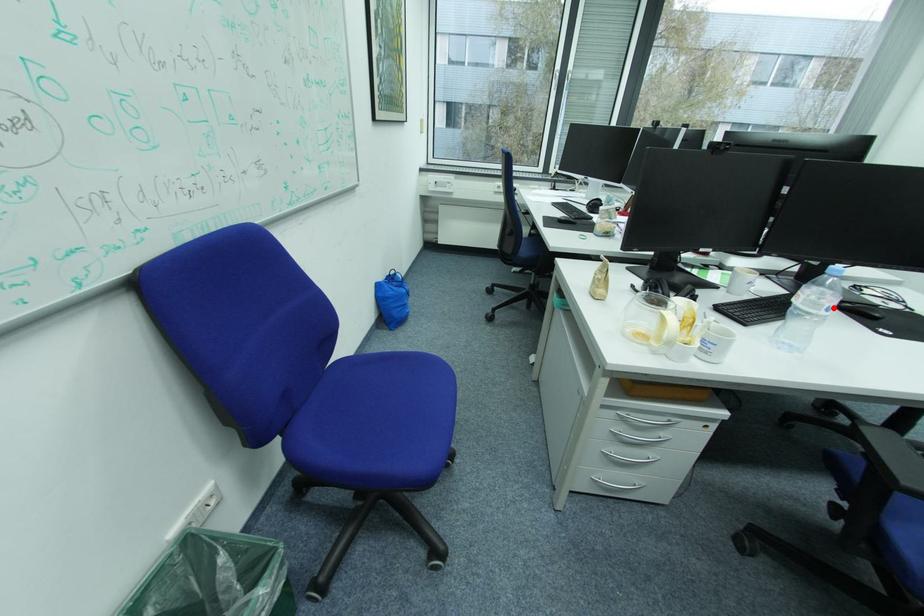
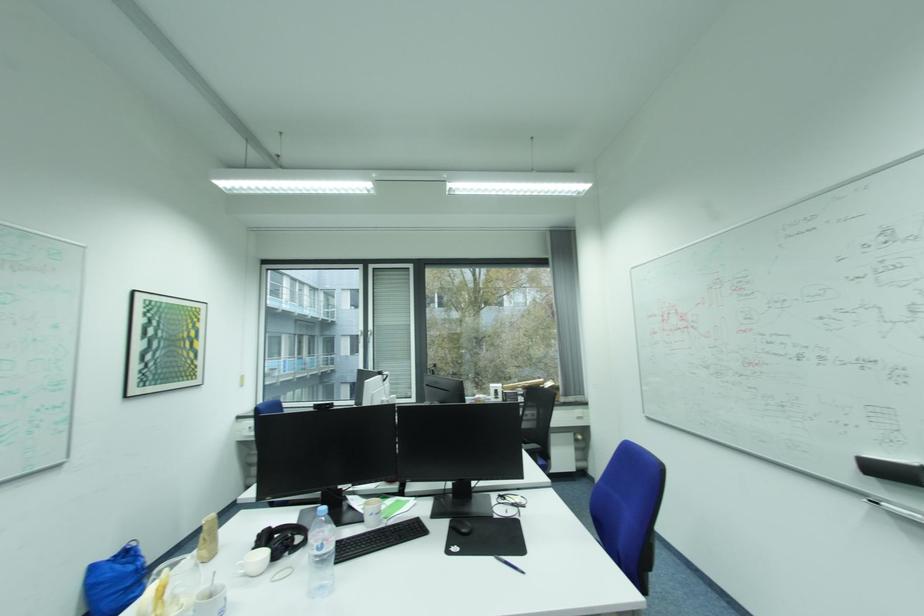
Question: I am providing you with two images of the same scene from different viewpoints. Image1 has a red point marked. In image2, the corresponding 3D location appears at what relative position? Reply with the corresponding letter.

Choices:
 (A) Closer
 (B) Farther

Answer: (B)